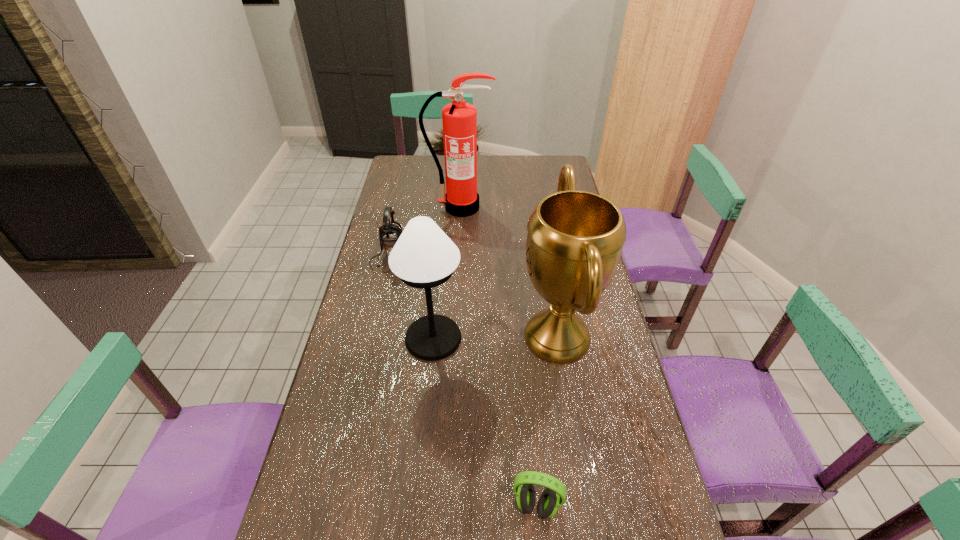
Image resolution: width=960 pixels, height=540 pixels. In order to click on vacant region that satisfies the following two spatial constraints: 1. with the nozzle aimed from the shortest object; 2. on the left side of the fire extinguisher in this screenshot , I will do `click(443, 505)`.